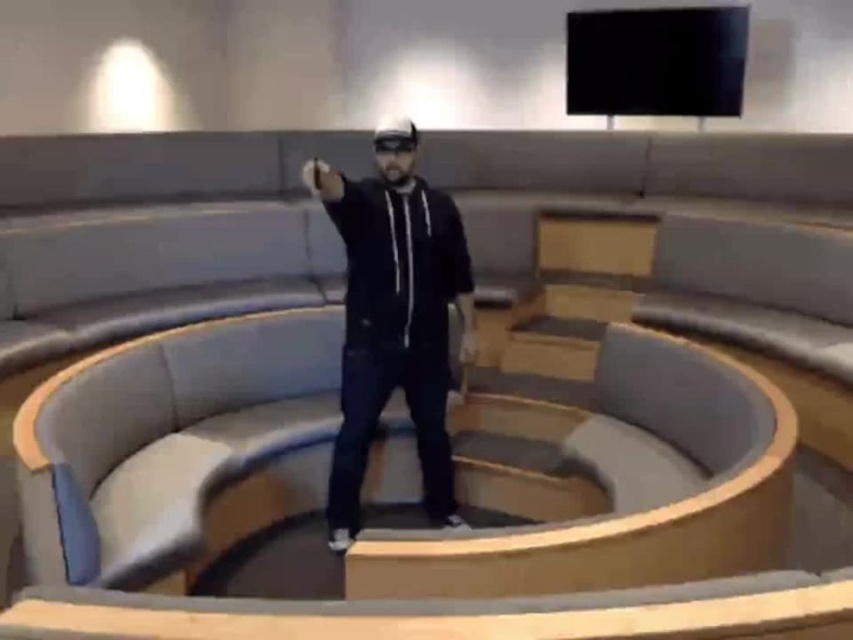
You are standing at the point marked as point [392,240] in the seating area. If you want to take a photo of the person pointing off camera with your smartphone, which has a 12MP camera sensor, will you be able to capture them clearly without moving closer than 2.65 meters?

The distance between point [392,240] and the camera is 2.65 meters. Since you are at that point, you are exactly 2.65 meters away from the person. Your smartphone with a 12MP sensor can capture clear images at this distance, so yes, you can take a clear photo without moving closer.

You are a fashion designer observing the modern circular seating area. You notice the black matte hoodie at center and the black matte goggles at center. Which item is positioned higher on the person?

The black matte hoodie at center is taller than the black matte goggles at center, so the hoodie is positioned higher on the person.

You are a photographer positioned at the center of the circular seating area. You want to take a photo that includes both the point at coordinates point (354, 314) and point (373, 147). Which point should you focus on first to ensure both are in sharp focus?

You should focus on point (373, 147) first because it is closer to the photographer than point (354, 314), which is further away. By focusing on the closer point, the further point will also be in focus due to the depth of field.